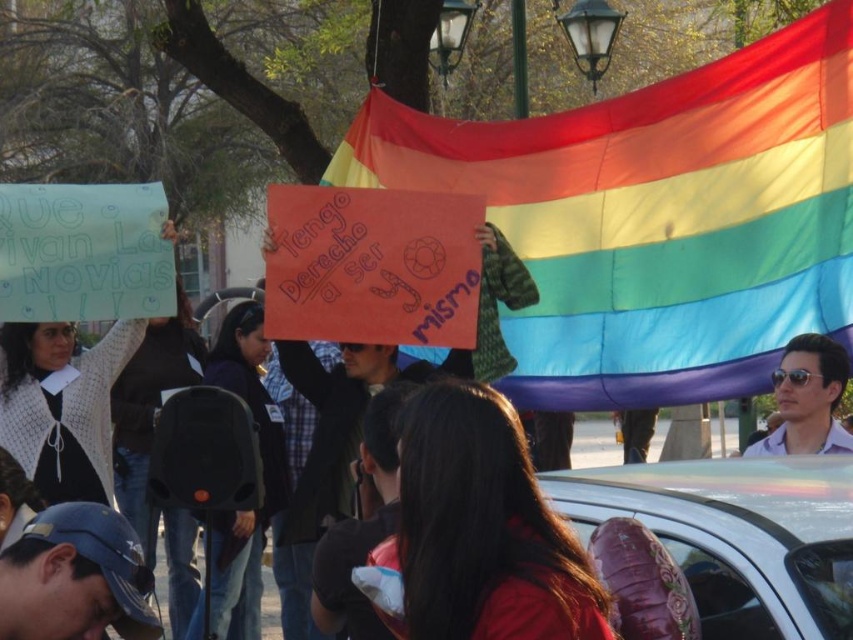
Is point (447, 454) positioned before point (834, 396)?

That is True.

Who is taller, dark brown hair at center or sunglasses matte man at right?

dark brown hair at center

Which is behind, point (460, 419) or point (842, 348)?

The point (842, 348) is more distant.

What are the coordinates of `dark brown hair at center` in the screenshot? It's located at coord(480,531).

Is rainbow fabric flag at center taller than dark brown hair at center?

Indeed, rainbow fabric flag at center has a greater height compared to dark brown hair at center.

Which is more to the left, rainbow fabric flag at center or dark brown hair at center?

dark brown hair at center is more to the left.

Consider the image. Who is more forward, [660,230] or [445,385]?

Positioned in front is point [445,385].

Image resolution: width=853 pixels, height=640 pixels. Identify the location of rainbow fabric flag at center. (656, 218).

Based on the photo, is rainbow fabric flag at center shorter than sunglasses matte man at right?

In fact, rainbow fabric flag at center may be taller than sunglasses matte man at right.

Can you confirm if rainbow fabric flag at center is positioned below sunglasses matte man at right?

Incorrect, rainbow fabric flag at center is not positioned below sunglasses matte man at right.

Identify the location of rainbow fabric flag at center. (656, 218).